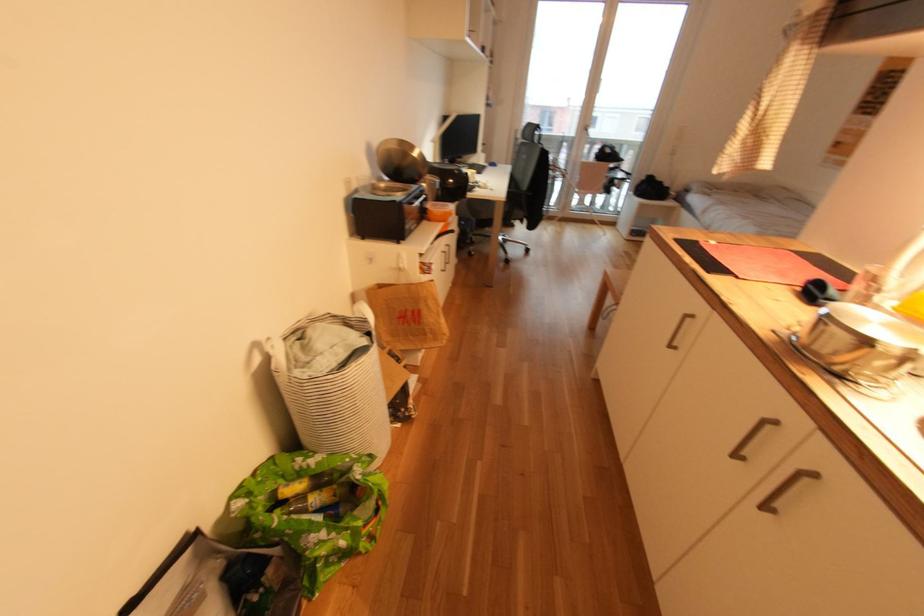
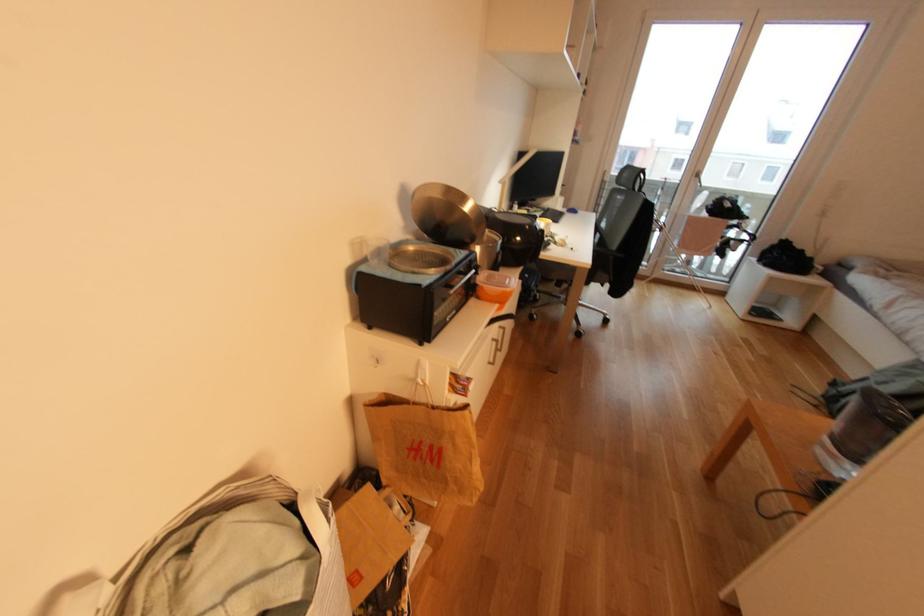
Question: Which direction would the cameraman need to move to produce the second image? Reply with the corresponding letter.

Choices:
 (A) Left
 (B) Right
 (C) Forward
 (D) Backward

Answer: (C)